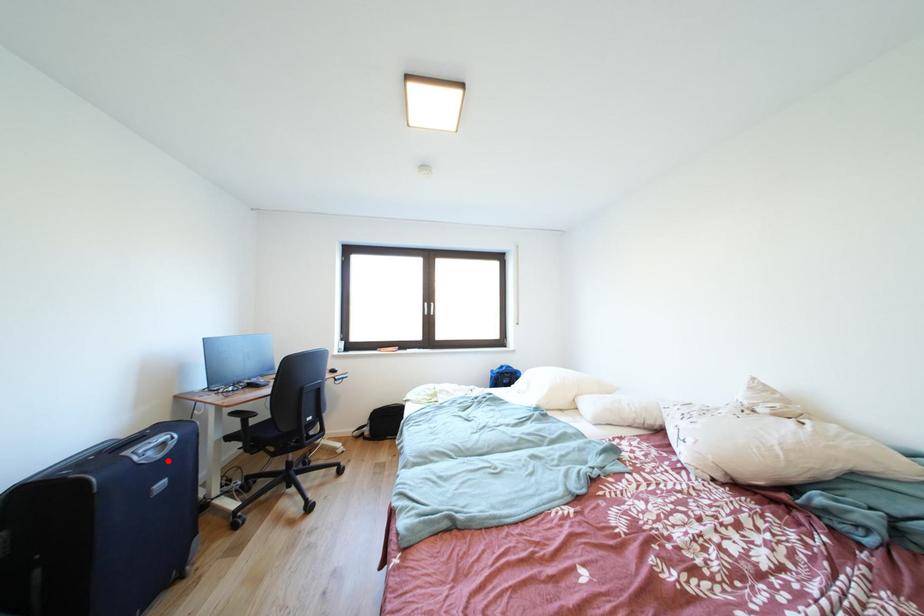
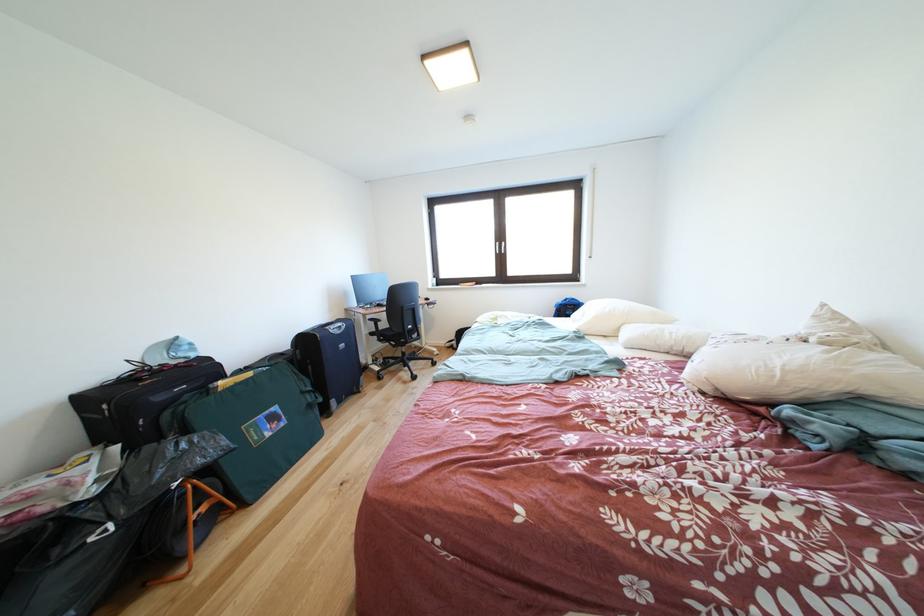
Question: I am providing you with two images of the same scene from different viewpoints. Image1 has a red point marked. In image2, the corresponding 3D location appears at what relative position? Reply with the corresponding letter.

Choices:
 (A) Closer
 (B) Farther

Answer: (A)